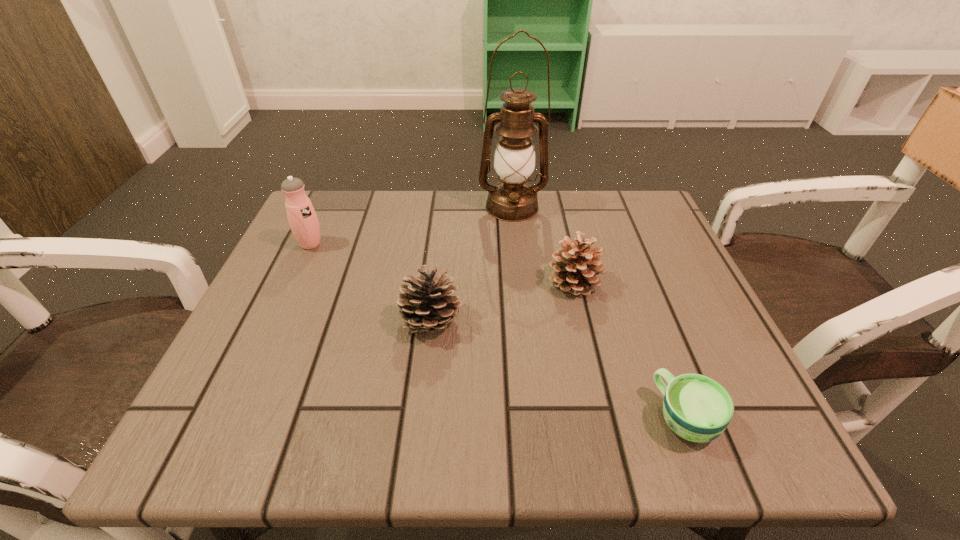
The image size is (960, 540). In order to click on free spot that satisfies the following two spatial constraints: 1. on the front side of the right pinecone; 2. on the left side of the farthest object in this screenshot , I will do `click(519, 282)`.

At what (x,y) coordinates should I click in order to perform the action: click on free point that satisfies the following two spatial constraints: 1. on the front side of the right pinecone; 2. on the right side of the fourth shortest object. Please return your answer as a coordinate pair (x, y). The image size is (960, 540). Looking at the image, I should click on (293, 282).

Identify the location of free spot that satisfies the following two spatial constraints: 1. on the front side of the right pinecone; 2. on the right side of the nearest object. The height and width of the screenshot is (540, 960). (607, 417).